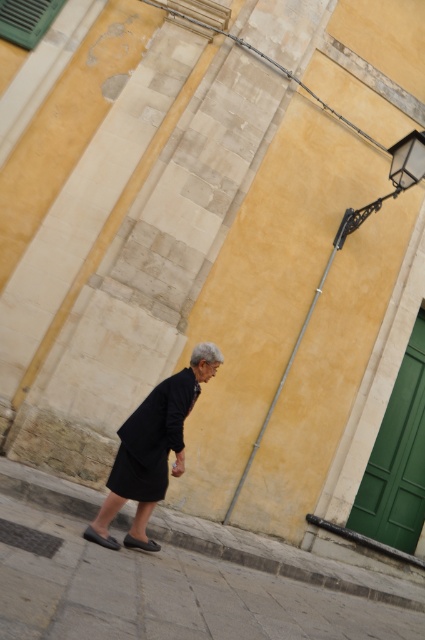
Does matte black dress at center have a greater width compared to metallic black streetlamp at right?

Indeed, matte black dress at center has a greater width compared to metallic black streetlamp at right.

Is matte black dress at center to the right of metallic black streetlamp at right from the viewer's perspective?

Incorrect, matte black dress at center is not on the right side of metallic black streetlamp at right.

Is point (121, 442) less distant than point (311, 304)?

Yes.

The image size is (425, 640). What are the coordinates of `matte black dress at center` in the screenshot? It's located at (155, 442).

How much distance is there between gray concrete pavement at lower center and matte black dress at center?

The distance of gray concrete pavement at lower center from matte black dress at center is 38.49 inches.

Locate an element on the screen. gray concrete pavement at lower center is located at coordinates (180, 582).

The width and height of the screenshot is (425, 640). Find the location of `gray concrete pavement at lower center`. gray concrete pavement at lower center is located at coordinates [180, 582].

What do you see at coordinates (342, 246) in the screenshot?
I see `metallic black streetlamp at right` at bounding box center [342, 246].

Between metallic black streetlamp at right and black leather sandal at lower center, which one is positioned lower?

black leather sandal at lower center

Which is behind, point (410, 173) or point (122, 541)?

Point (410, 173)

I want to click on metallic black streetlamp at right, so click(x=342, y=246).